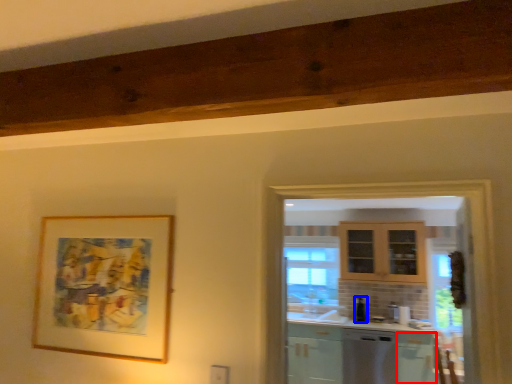
Question: Among these objects, which one is nearest to the camera, cabinetry (highlighted by a red box) or appliance (highlighted by a blue box)?

Choices:
 (A) cabinetry
 (B) appliance

Answer: (A)